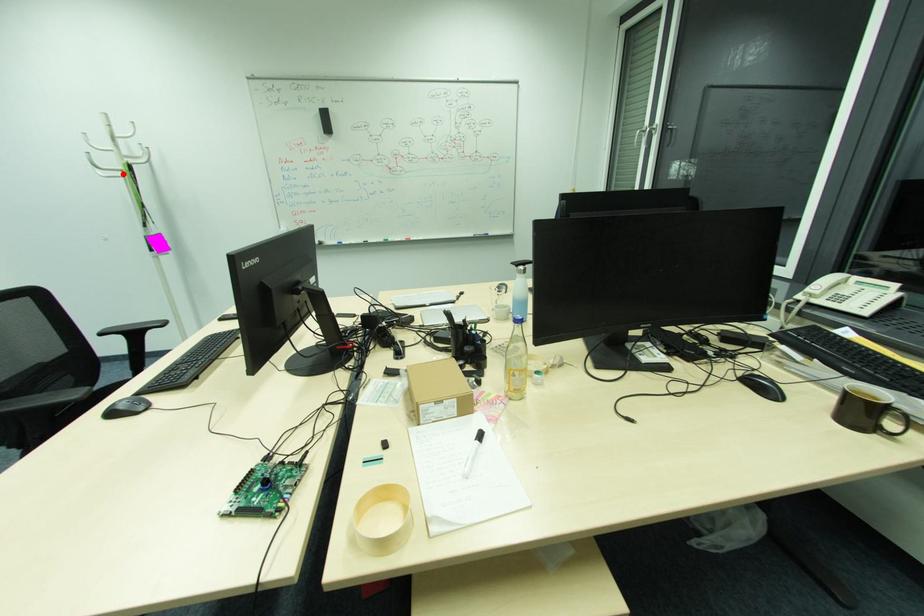
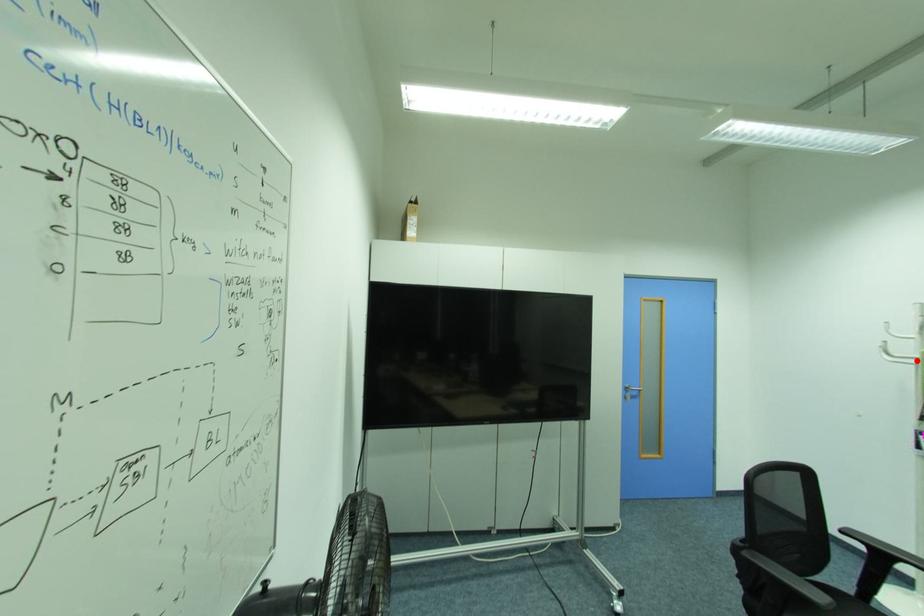
I am providing you with two images of the same scene from different viewpoints. A red point is marked on the first image and another point is marked on the second image. Do the highlighted points in image1 and image2 indicate the same real-world spot?

Yes